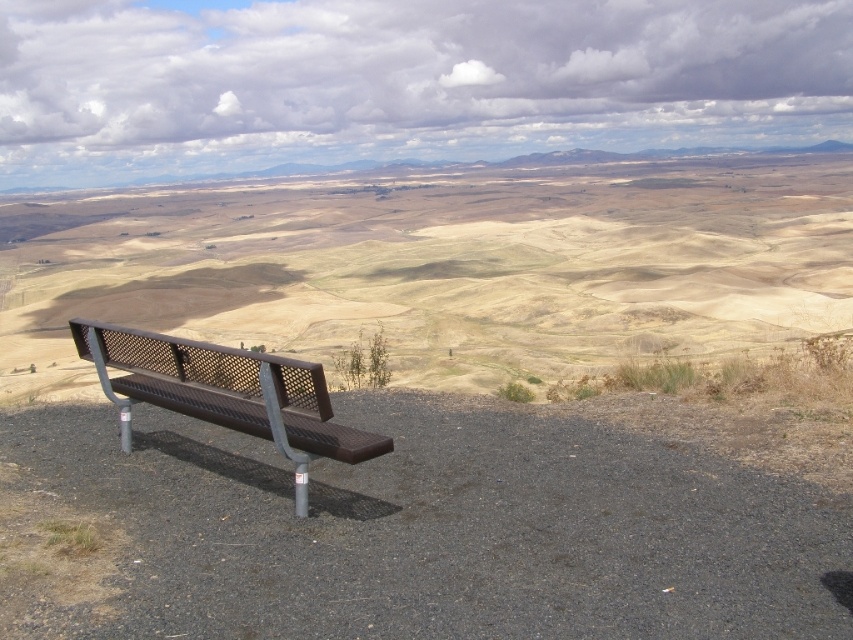
You are standing at the top of a hill overlooking the landscape. You see the brown textured bench at lower left and the brown metal bench at lower left. Which bench is closer to you?

The brown textured bench at lower left is closer to you because it is in front of the brown metal bench at lower left.

You are standing at the top of a hill overlooking a gravelly area with two benches. You notice the brown textured bench at lower left and the brown metal bench at lower left. Which bench is higher in height?

The brown textured bench at lower left is taller than the brown metal bench at lower left.

You are a photographer wanting to capture the brown textured bench at lower left and the brown metal bench at lower left in a single shot. Since both are at the lower left, how can you ensure both are visible in your photo?

The brown textured bench at lower left is positioned over the brown metal bench at lower left, so you can adjust your camera angle to capture both benches by tilting upwards slightly to include the upper part of the brown textured bench at lower left while still framing the brown metal bench at lower left below it.